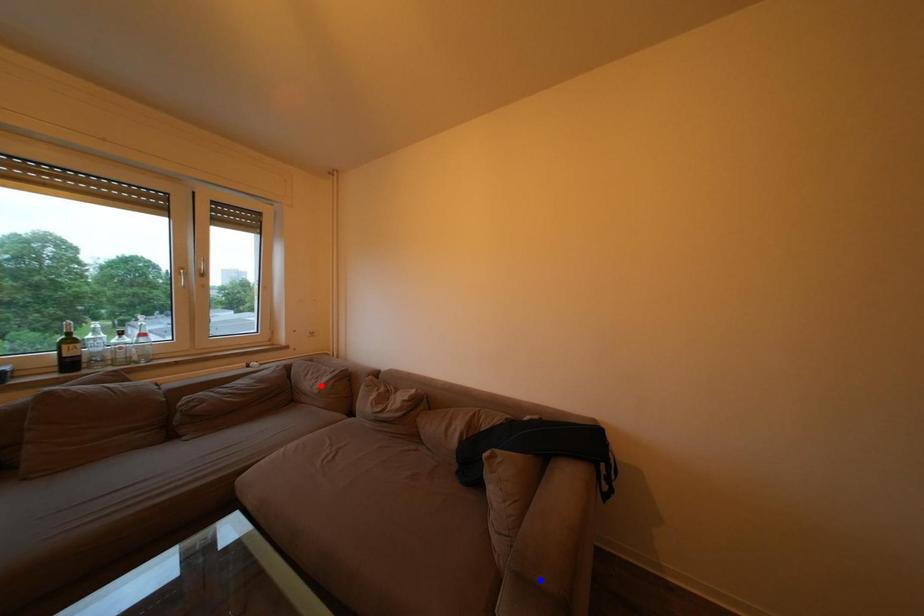
Question: Two points are marked on the image. Which point is closer to the camera?

Choices:
 (A) Blue point is closer.
 (B) Red point is closer.

Answer: (A)